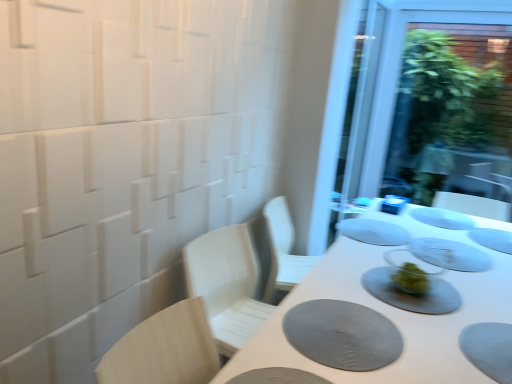
Find the location of a particular element. This screenshot has width=512, height=384. free space in front of white matte plate at center, arranged as the 2th tableware when viewed from the back is located at coordinates (435, 231).